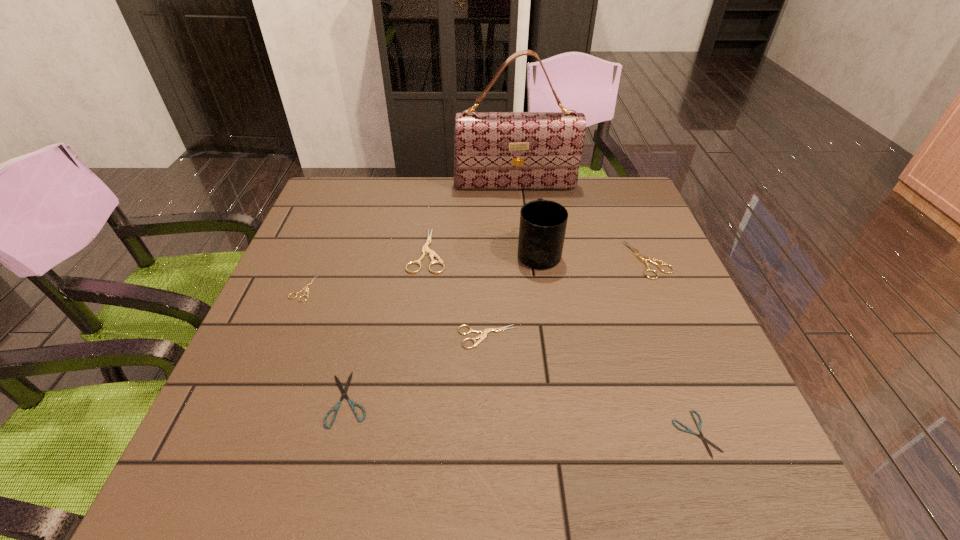
Image resolution: width=960 pixels, height=540 pixels. Identify the location of free spot between the fifth tallest object and the tallest object. (501, 262).

What are the coordinates of `vacant space that is in between the smallest beige shears and the tallest shears` in the screenshot? It's located at (366, 269).

Where is `vacant space that is in between the handbag and the second shears from left to right`? This screenshot has height=540, width=960. vacant space that is in between the handbag and the second shears from left to right is located at coordinates (432, 293).

This screenshot has width=960, height=540. In order to click on vacant space that's between the rightmost beige shears and the third shears from right to left in this screenshot , I will do pos(567,299).

Identify which object is the seventh nearest to the third object from left to right. Please provide its 2D coordinates. Your answer should be formatted as a tuple, i.e. [(x, y)], where the tuple contains the x and y coordinates of a point satisfying the conditions above.

[(688, 430)]

The height and width of the screenshot is (540, 960). I want to click on object that is the third closest to the smaller black shears, so click(543, 223).

Find the location of a particular element. shears identified as the third closest to the third shears from right to left is located at coordinates [x=688, y=430].

Image resolution: width=960 pixels, height=540 pixels. Identify the location of the closest shears to the tallest shears. (484, 332).

Point out which beige shears is positioned as the third nearest to the fifth shears from right to left. Please provide its 2D coordinates. Your answer should be formatted as a tuple, i.e. [(x, y)], where the tuple contains the x and y coordinates of a point satisfying the conditions above.

[(425, 250)]

Find the location of a particular element. beige shears that is the third closest to the fifth shortest object is located at coordinates [305, 287].